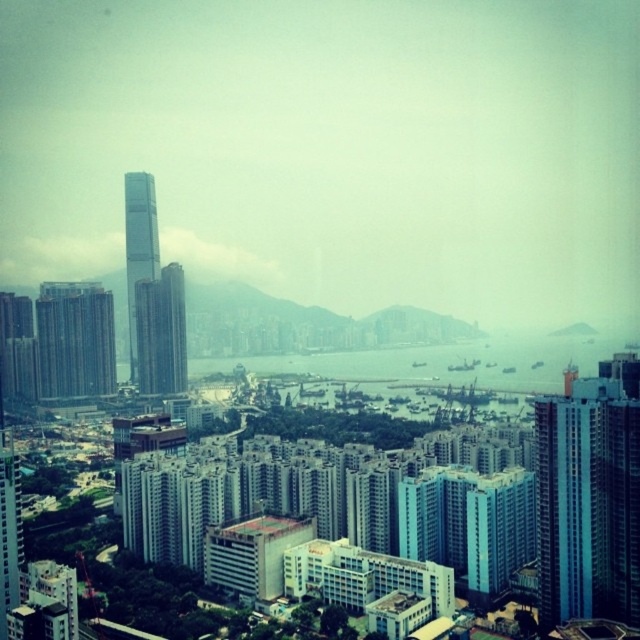
Question: Which of these objects is positioned farthest from the blue water at center?

Choices:
 (A) blue glass building at left
 (B) glassy skyscraper at left
 (C) glassy steel skyscraper at center-left

Answer: (B)

Question: Based on their relative distances, which object is farther from the blue water at center?

Choices:
 (A) glassy steel skyscraper at center-left
 (B) blue glassy building at right
 (C) glassy skyscraper at left
 (D) blue glass building at left

Answer: (B)

Question: Considering the real-world distances, which object is farthest from the blue water at center?

Choices:
 (A) blue glassy building at right
 (B) glassy steel skyscraper at center-left

Answer: (A)

Question: Can you confirm if blue glassy building at right is positioned to the left of blue glass building at left?

Choices:
 (A) no
 (B) yes

Answer: (A)

Question: Is blue glassy building at right bigger than glassy skyscraper at left?

Choices:
 (A) no
 (B) yes

Answer: (A)

Question: Does blue glassy building at right appear on the right side of blue glass building at left?

Choices:
 (A) no
 (B) yes

Answer: (B)